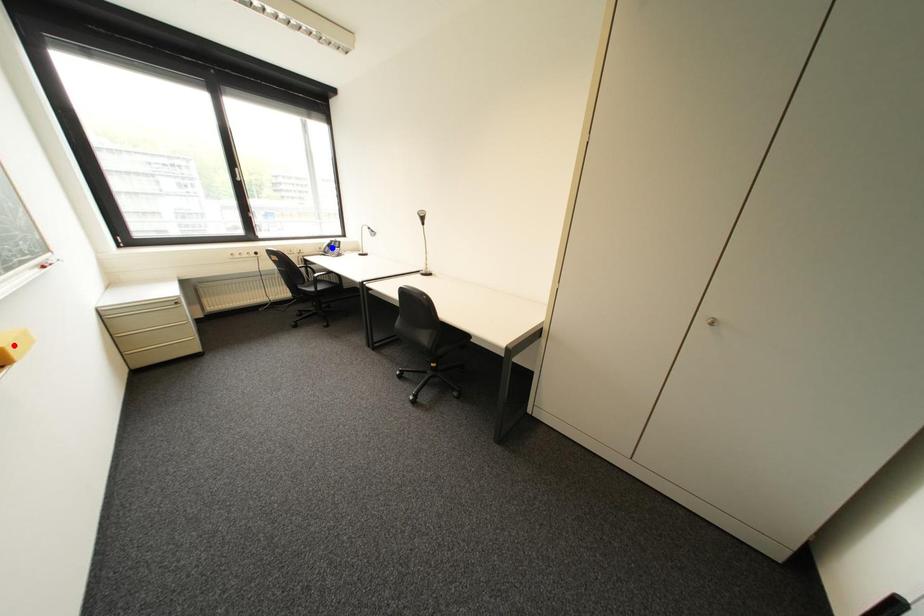
Question: In the image, two points are highlighted. Which point is nearer to the camera? Reply with the corresponding letter.

Choices:
 (A) blue point
 (B) red point

Answer: (B)